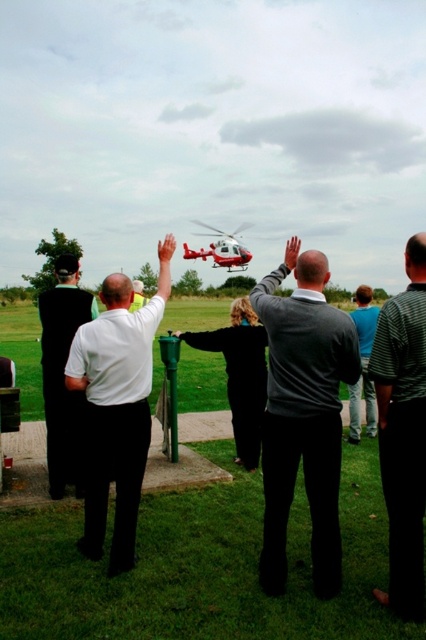
You are a photographer at this event and want to capture a photo where both the black matte suit at left and the red glossy helicopter at center are visible. Considering their heights, which object might appear smaller in the photo?

The black matte suit at left appears smaller in the photo because it has a lesser height compared to the red glossy helicopter at center.

You are a photographer at the event and need to capture a photo that includes both the black matte suit at left and the red glossy helicopter at center. Based on their positions, which object should be placed on the left side of the photo frame?

The black matte suit at left should be placed on the left side of the photo frame since it is positioned on the left side of the red glossy helicopter at center.

You are a photographer at this event and want to capture a photo where the white matte shirt at center and the red glossy helicopter at center are both clearly visible. Based on their positions, which object is closer to the camera?

The white matte shirt at center is closer to the camera because it is positioned below the red glossy helicopter at center, indicating it is in a lower spatial plane relative to the camera.